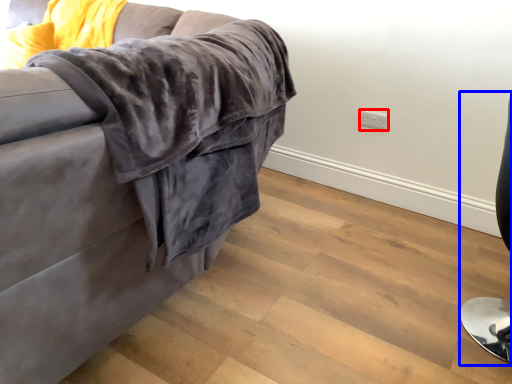
Question: Which of the following is the farthest to the observer, electric outlet (highlighted by a red box) or computer chair (highlighted by a blue box)?

Choices:
 (A) electric outlet
 (B) computer chair

Answer: (A)